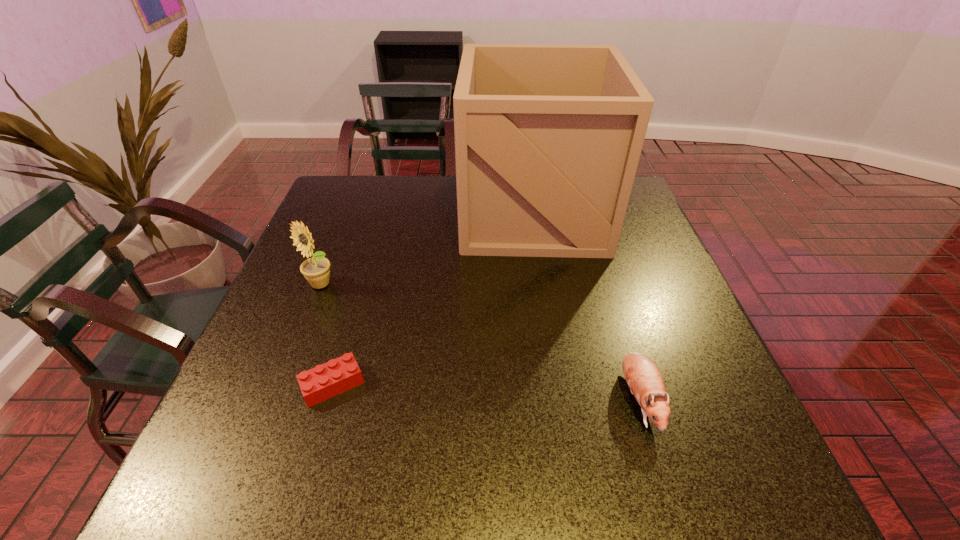
Where is `object that is the third closest to the shortest object`? This screenshot has width=960, height=540. object that is the third closest to the shortest object is located at coordinates (643, 377).

This screenshot has width=960, height=540. I want to click on object that ranks as the closest to the third shortest object, so click(x=336, y=376).

Where is `vacant region that satisfies the following two spatial constraints: 1. on the face of the third nearest object; 2. on the right side of the Lego`? vacant region that satisfies the following two spatial constraints: 1. on the face of the third nearest object; 2. on the right side of the Lego is located at coordinates pyautogui.click(x=280, y=384).

Where is `free location that satisfies the following two spatial constraints: 1. on the face of the Lego; 2. on the left side of the third shortest object`? The width and height of the screenshot is (960, 540). free location that satisfies the following two spatial constraints: 1. on the face of the Lego; 2. on the left side of the third shortest object is located at coordinates (280, 384).

The image size is (960, 540). In order to click on vacant space that satisfies the following two spatial constraints: 1. on the face of the shortest object; 2. on the right side of the sunflower in this screenshot , I will do `click(280, 384)`.